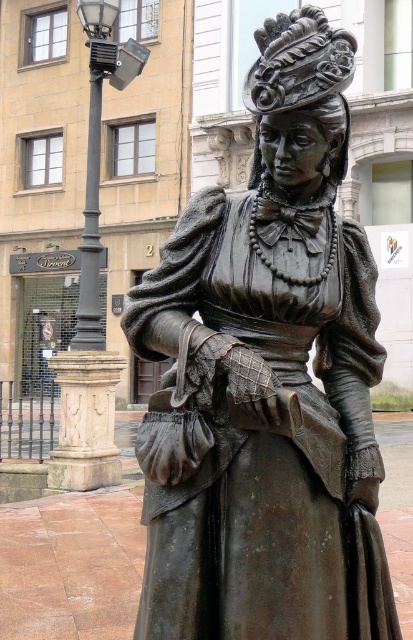
Question: From the image, what is the correct spatial relationship of bronze statue at center in relation to black metal streetlamp at upper left?

Choices:
 (A) right
 (B) left

Answer: (A)

Question: Considering the relative positions of bronze statue at center and black metal streetlamp at upper left in the image provided, where is bronze statue at center located with respect to black metal streetlamp at upper left?

Choices:
 (A) right
 (B) left

Answer: (A)

Question: Which point appears closest to the camera in this image?

Choices:
 (A) (92, 256)
 (B) (230, 602)

Answer: (B)

Question: Can you confirm if bronze statue at center is smaller than black metal streetlamp at upper left?

Choices:
 (A) yes
 (B) no

Answer: (A)

Question: Which point is closer to the camera?

Choices:
 (A) (116, 3)
 (B) (285, 96)

Answer: (B)